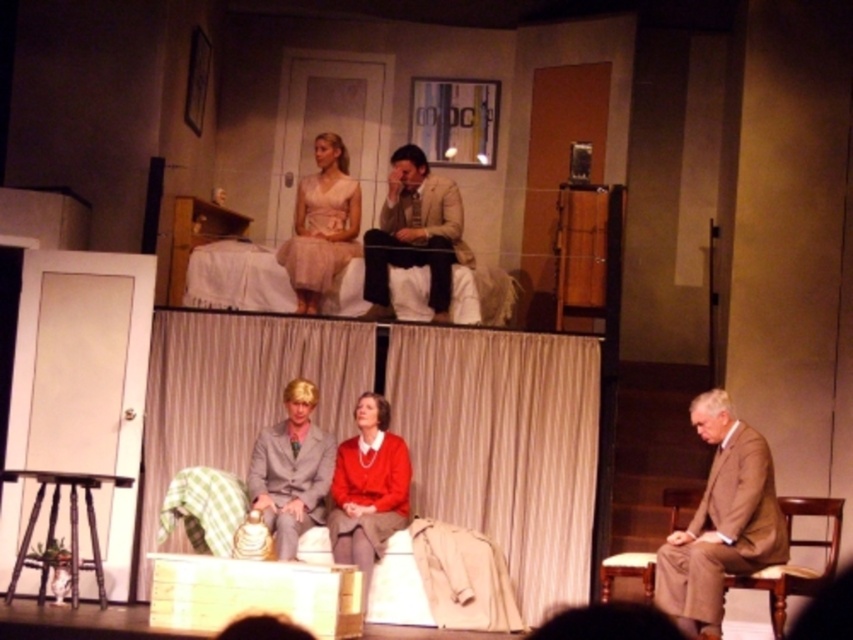
In order to click on tan wool suit at lower right in this screenshot , I will do `click(721, 522)`.

Is tan wool suit at lower right shorter than light brown wooden chair at lower right?

No.

Does point (683, 582) lie in front of point (689, 508)?

That is True.

I want to click on tan wool suit at lower right, so click(721, 522).

Who is shorter, matte red sweater at center or light brown wooden chair at lower right?

light brown wooden chair at lower right

Is matte red sweater at center further to the viewer compared to light brown wooden chair at lower right?

Yes, it is behind light brown wooden chair at lower right.

This screenshot has width=853, height=640. I want to click on matte red sweater at center, so click(x=368, y=488).

Locate an element on the screen. This screenshot has height=640, width=853. matte red sweater at center is located at coordinates (368, 488).

Who is more forward, (x=775, y=522) or (x=340, y=545)?

Point (x=775, y=522) is more forward.

Can you confirm if tan wool suit at lower right is thinner than matte red sweater at center?

In fact, tan wool suit at lower right might be wider than matte red sweater at center.

Between point (738, 477) and point (405, 486), which one is positioned behind?

Point (405, 486)

In order to click on tan wool suit at lower right in this screenshot , I will do `click(721, 522)`.